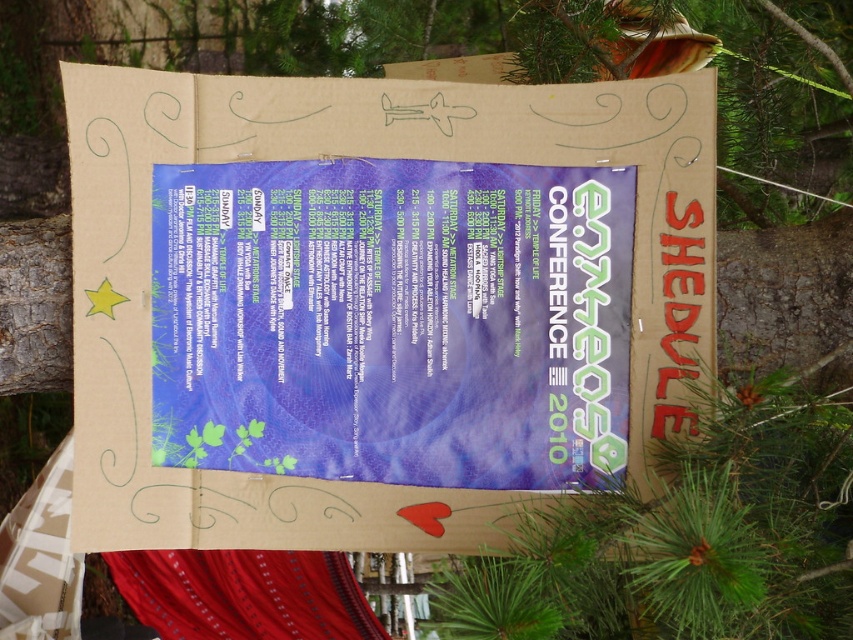
Question: Can you confirm if brown cardboard at center is wider than matte blue poster at center?

Choices:
 (A) no
 (B) yes

Answer: (B)

Question: Is brown cardboard at center bigger than matte blue poster at center?

Choices:
 (A) yes
 (B) no

Answer: (A)

Question: Which of the following is the farthest from the observer?

Choices:
 (A) (161, 291)
 (B) (445, 272)

Answer: (B)

Question: Can you confirm if brown cardboard at center is wider than matte blue poster at center?

Choices:
 (A) yes
 (B) no

Answer: (A)

Question: Which of the following is the farthest from the observer?

Choices:
 (A) matte blue poster at center
 (B) brown cardboard at center

Answer: (A)

Question: Which point is farther to the camera?

Choices:
 (A) matte blue poster at center
 (B) brown cardboard at center

Answer: (A)